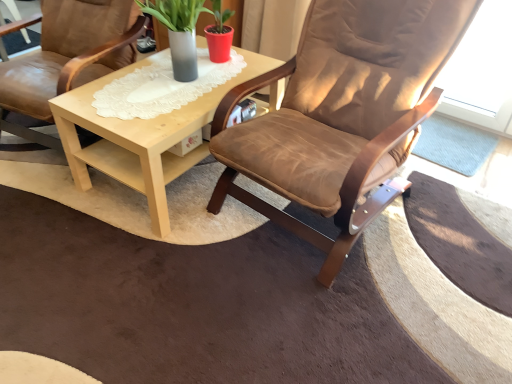
The image size is (512, 384). Identify the location of free space that is to the left of matte gray vase at center. (119, 79).